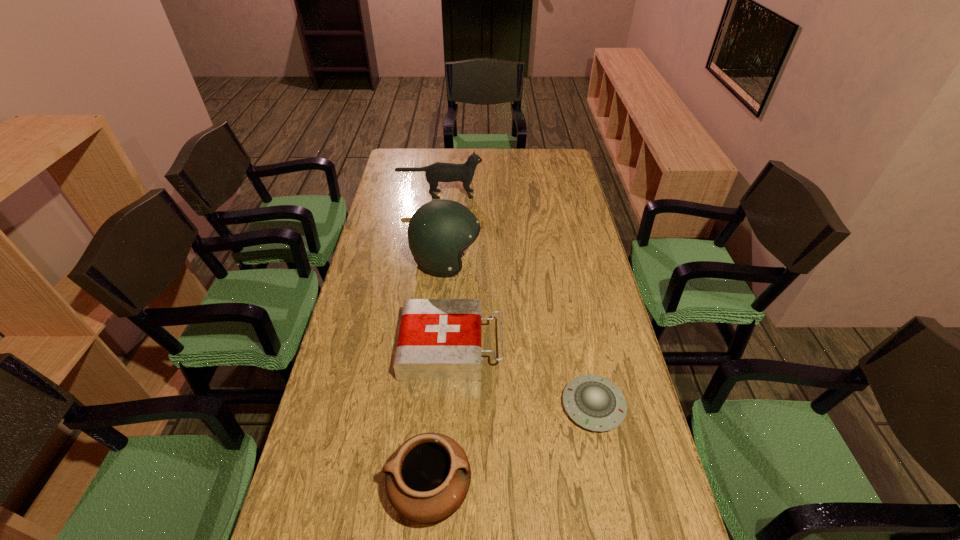
The image size is (960, 540). What are the coordinates of `vacant space at the far right corner` in the screenshot? It's located at (565, 164).

Where is `free spot between the first-aid kit and the nearest object`? free spot between the first-aid kit and the nearest object is located at coordinates (441, 418).

Find the location of a particular element. free space that is in between the shortest object and the pottery is located at coordinates (512, 448).

This screenshot has width=960, height=540. Identify the location of free space between the second farthest object and the shortest object. (519, 333).

You are a GUI agent. You are given a task and a screenshot of the screen. Output one action in this format:
    pyautogui.click(x=<x>, y=<y>)
    Task: Click on the unoccupied area between the cat and the shortest object
    The height and width of the screenshot is (540, 960).
    Given the screenshot: What is the action you would take?
    pyautogui.click(x=516, y=300)

Select which object is the second closest to the second farthest object. Please provide its 2D coordinates. Your answer should be formatted as a tuple, i.e. [(x, y)], where the tuple contains the x and y coordinates of a point satisfying the conditions above.

[(438, 172)]

Locate an element on the screen. The height and width of the screenshot is (540, 960). the second closest object relative to the tallest object is located at coordinates (438, 172).

Where is `vacant region that satisfies the following two spatial constraints: 1. on the back side of the rightmost object; 2. on the front-facing side of the cat`? This screenshot has width=960, height=540. vacant region that satisfies the following two spatial constraints: 1. on the back side of the rightmost object; 2. on the front-facing side of the cat is located at coordinates (550, 194).

The width and height of the screenshot is (960, 540). In order to click on blank area in the image that satisfies the following two spatial constraints: 1. on the front-facing side of the pottery; 2. on the left side of the cat in this screenshot , I will do `click(406, 490)`.

Find the location of a particular element. The width and height of the screenshot is (960, 540). vacant space that satisfies the following two spatial constraints: 1. on the front-facing side of the fourth shortest object; 2. on the back side of the saucer is located at coordinates (416, 406).